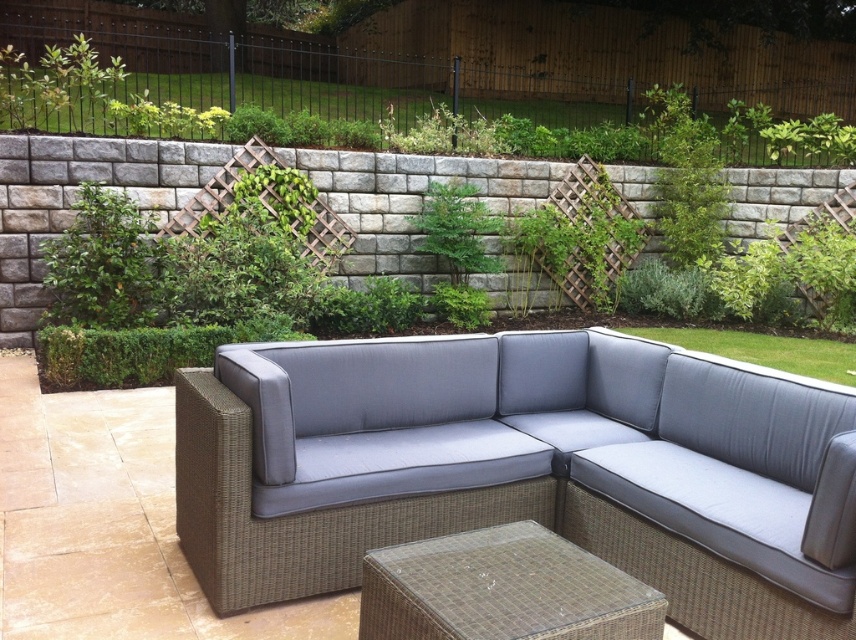
Question: Which of the following is the closest to the observer?

Choices:
 (A) woven rattan couch at center
 (B) woven rattan side table at lower center

Answer: (B)

Question: Is woven rattan couch at center wider than woven rattan side table at lower center?

Choices:
 (A) no
 (B) yes

Answer: (B)

Question: Which point appears closest to the camera in this image?

Choices:
 (A) (619, 572)
 (B) (235, 586)

Answer: (A)

Question: Is the position of woven rattan couch at center more distant than that of woven rattan side table at lower center?

Choices:
 (A) yes
 (B) no

Answer: (A)

Question: Is woven rattan couch at center to the right of woven rattan side table at lower center from the viewer's perspective?

Choices:
 (A) yes
 (B) no

Answer: (B)

Question: Which point is farther to the camera?

Choices:
 (A) woven rattan couch at center
 (B) woven rattan side table at lower center

Answer: (A)